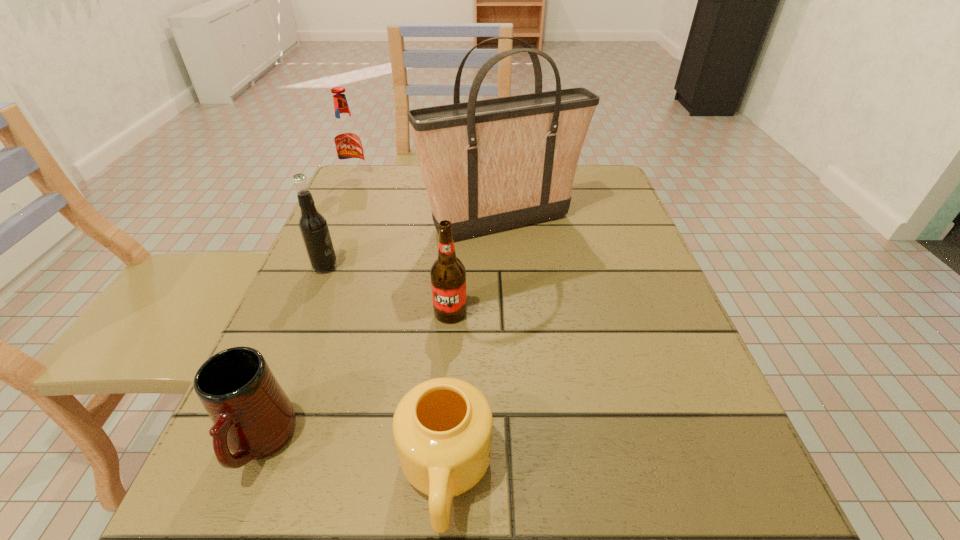
Identify which object is located as the fifth nearest to the farthest root beer. Please provide its 2D coordinates. Your answer should be formatted as a tuple, i.e. [(x, y)], where the tuple contains the x and y coordinates of a point satisfying the conditions above.

[(442, 428)]

Identify which root beer is the second nearest to the second farthest root beer. Please provide its 2D coordinates. Your answer should be formatted as a tuple, i.e. [(x, y)], where the tuple contains the x and y coordinates of a point satisfying the conditions above.

[(347, 137)]

Identify which root beer is the second nearest to the second nearest root beer. Please provide its 2D coordinates. Your answer should be formatted as a tuple, i.e. [(x, y)], where the tuple contains the x and y coordinates of a point satisfying the conditions above.

[(347, 137)]

Locate an element on the screen. Image resolution: width=960 pixels, height=540 pixels. free space that satisfies the following two spatial constraints: 1. on the label of the second farthest root beer; 2. on the right side of the rightmost root beer is located at coordinates (306, 313).

The width and height of the screenshot is (960, 540). In order to click on free space that satisfies the following two spatial constraints: 1. on the back side of the shopping bag; 2. on the right side of the fourth farthest object in this screenshot , I will do `click(457, 223)`.

In order to click on vacant space that satisfies the following two spatial constraints: 1. on the label of the fourth nearest object; 2. on the right side of the nearest root beer in this screenshot , I will do `click(306, 313)`.